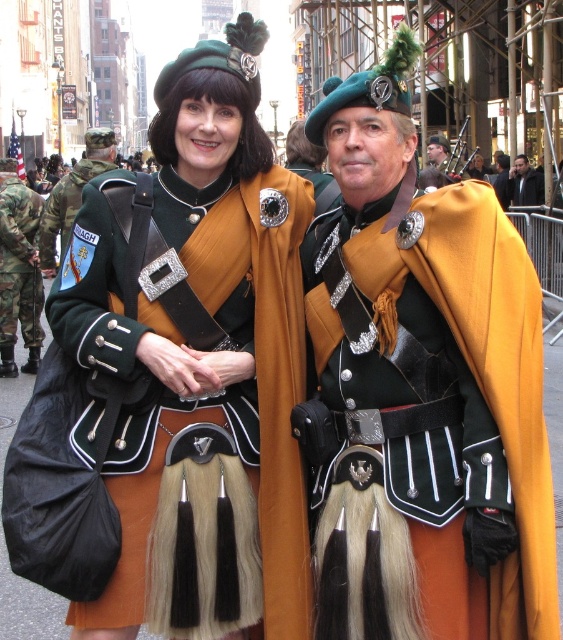
Question: Based on their relative distances, which object is nearer to the camouflage fabric pants at left?

Choices:
 (A) shiny gold chain at center
 (B) camouflage fabric military uniform at left

Answer: (B)

Question: Is gold matte cape at center positioned at the back of camouflage fabric pants at left?

Choices:
 (A) yes
 (B) no

Answer: (B)

Question: Is gold matte cape at center to the right of camouflage fabric military uniform at left from the viewer's perspective?

Choices:
 (A) yes
 (B) no

Answer: (A)

Question: Does camouflage fabric pants at left appear on the right side of camouflage fabric military uniform at left?

Choices:
 (A) no
 (B) yes

Answer: (A)

Question: Which point is closer to the camera?

Choices:
 (A) (271, 605)
 (B) (91, 131)
 (C) (432, 161)
 (D) (501, 289)

Answer: (D)

Question: Which of these objects is positioned closest to the matte black kilt at center?

Choices:
 (A) shiny gold chain at center
 (B) camouflage fabric pants at left
 (C) camouflage fabric military uniform at left
 (D) gold matte cape at center

Answer: (D)